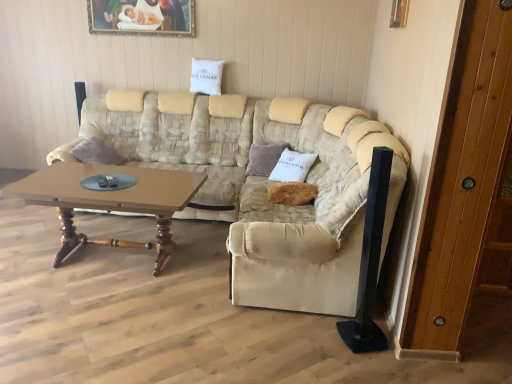
The height and width of the screenshot is (384, 512). Identify the location of unoccupied area in front of brown wooden coffee table at center. (117, 334).